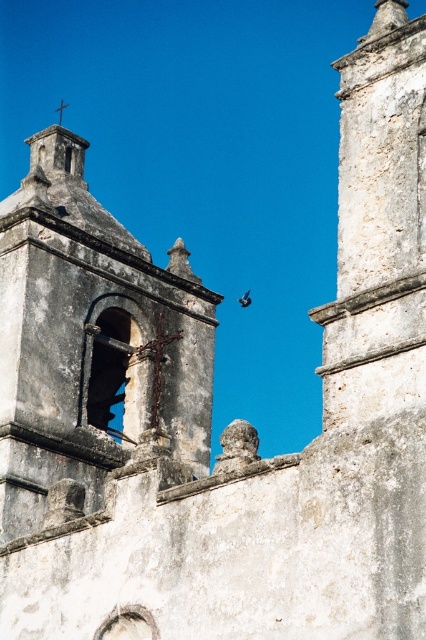
Between white stone tower at upper right and brown feathered bird at upper center, which one is positioned lower?

brown feathered bird at upper center is lower down.

Does white stone tower at upper right appear on the left side of brown feathered bird at upper center?

In fact, white stone tower at upper right is to the right of brown feathered bird at upper center.

Where is `white stone tower at upper right`? The image size is (426, 640). white stone tower at upper right is located at coordinates [x=379, y=227].

Based on the photo, is white stone bell tower at upper left above brown feathered bird at upper center?

Yes.

In the scene shown: Is white stone bell tower at upper left positioned behind brown feathered bird at upper center?

No, it is not.

Is point (80, 348) closer to camera compared to point (244, 298)?

Yes, point (80, 348) is in front of point (244, 298).

Where is `white stone bell tower at upper left`? white stone bell tower at upper left is located at coordinates (92, 344).

Between point (78, 253) and point (391, 29), which one is positioned behind?

The point (78, 253) is behind.

Does point (11, 346) come behind point (336, 380)?

Yes, point (11, 346) is behind point (336, 380).

Locate an element on the screen. The height and width of the screenshot is (640, 426). white stone bell tower at upper left is located at coordinates (92, 344).